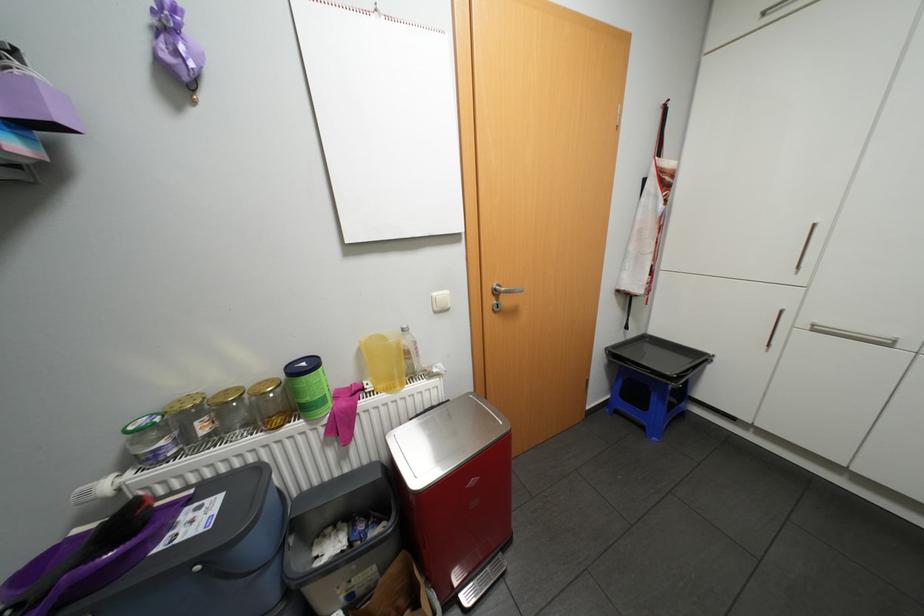
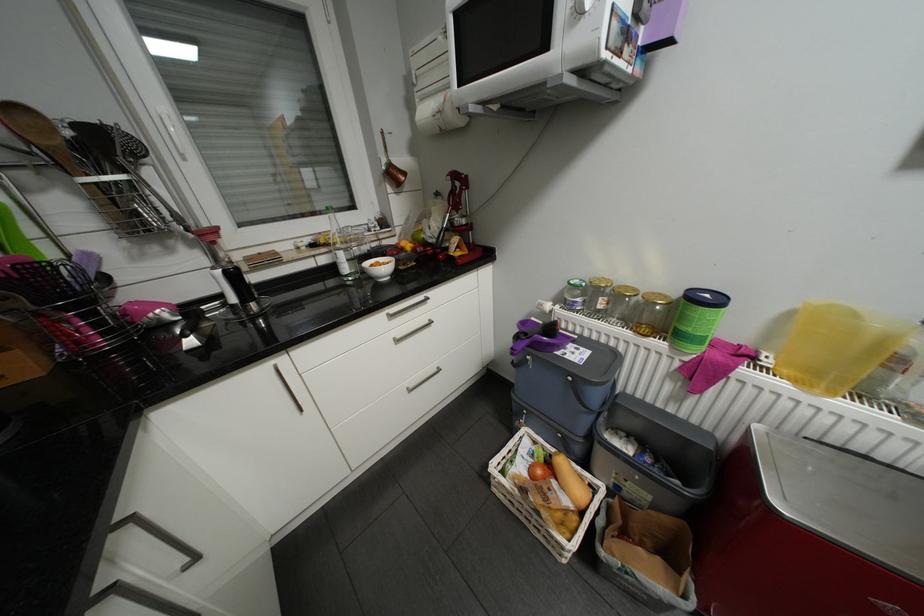
First-person continuous shooting, in which direction is the camera rotating?

The camera rotated toward left-down.